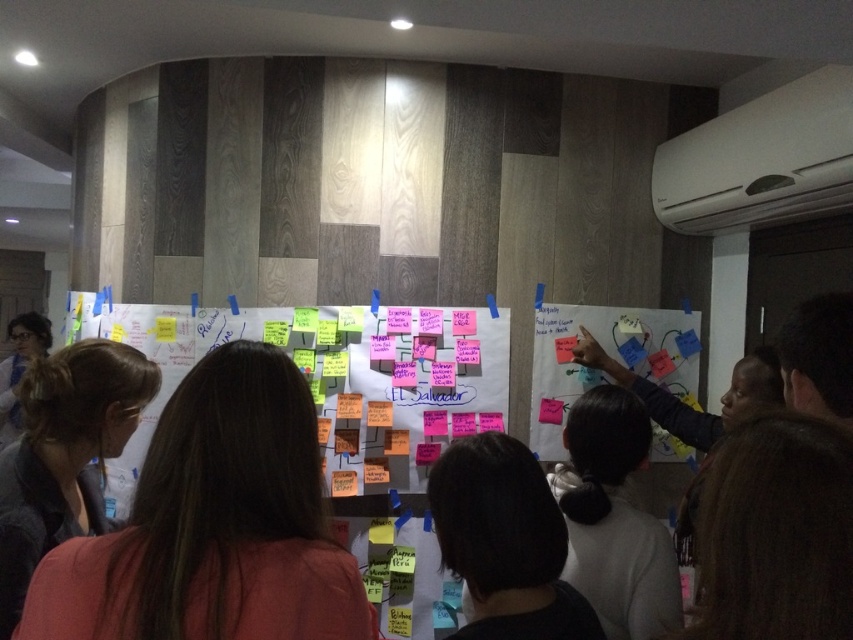
Who is shorter, dark brown hair at left or dark brown hair at center?

Standing shorter between the two is dark brown hair at center.

Who is higher up, dark brown hair at left or dark brown hair at center?

Positioned higher is dark brown hair at center.

Who is more distant from viewer, (62,381) or (503,513)?

The point (62,381) is more distant.

Where is `dark brown hair at left`? Image resolution: width=853 pixels, height=640 pixels. dark brown hair at left is located at coordinates (64, 454).

Between point (457, 496) and point (695, 355), which one is positioned behind?

Point (695, 355)

Is point (473, 442) positioned in front of point (636, 358)?

That is True.

Does point (486, 513) lie behind point (654, 460)?

No, it is in front of (654, 460).

Identify the location of dark brown hair at center. (505, 541).

Is point (91, 339) closer to camera compared to point (608, 588)?

No, (91, 339) is further to viewer.

Is point (79, 396) positioned behind point (624, 512)?

That is False.

The image size is (853, 640). What are the coordinates of `dark brown hair at left` in the screenshot? It's located at (64, 454).